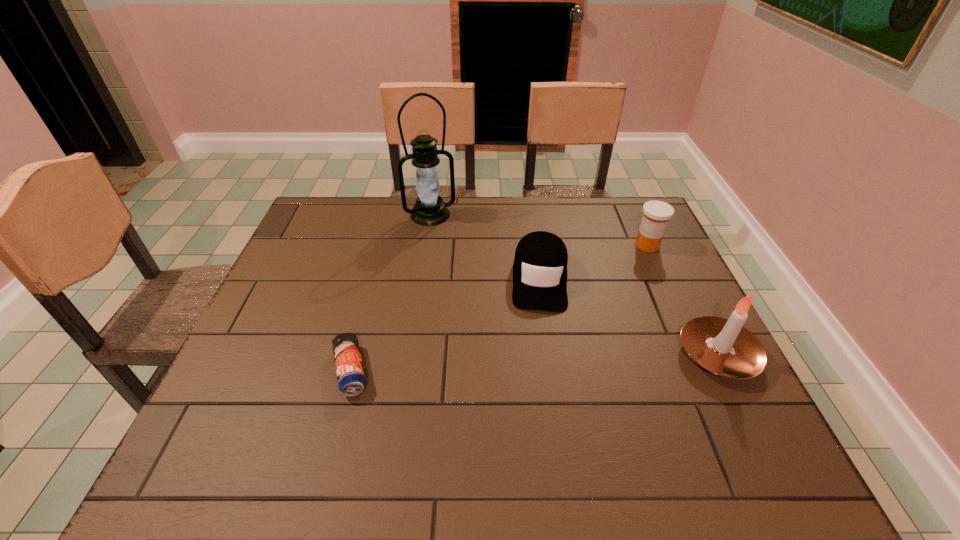
Find the location of a particular element. the shortest object is located at coordinates (351, 379).

Locate an element on the screen. the fourth shortest object is located at coordinates (724, 347).

The width and height of the screenshot is (960, 540). I want to click on cap, so click(x=540, y=264).

Locate an element on the screen. the third object from right to left is located at coordinates (540, 264).

At what (x,y) coordinates should I click in order to perform the action: click on medicine. Please return your answer as a coordinate pair (x, y). Image resolution: width=960 pixels, height=540 pixels. Looking at the image, I should click on (656, 214).

Where is `the farthest object`? This screenshot has height=540, width=960. the farthest object is located at coordinates (430, 209).

Image resolution: width=960 pixels, height=540 pixels. I want to click on the tallest object, so click(x=430, y=209).

You are a GUI agent. You are given a task and a screenshot of the screen. Output one action in this format:
    pyautogui.click(x=<x>, y=<y>)
    Task: Click on the vacant space situated 0.290m on the right of the shortest object
    
    Given the screenshot: What is the action you would take?
    pyautogui.click(x=501, y=371)

Find the location of a particular element. This screenshot has width=960, height=540. vacant point located on the left of the candle is located at coordinates (584, 355).

The image size is (960, 540). What are the coordinates of `blank space located 0.220m on the front-facing side of the second shortest object` in the screenshot? It's located at (540, 387).